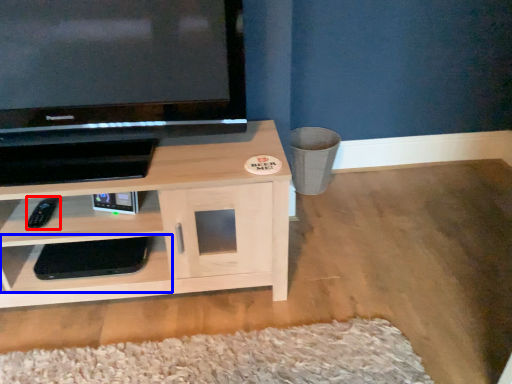
Question: Which of the following is the farthest to the observer, remote (highlighted by a red box) or shelf (highlighted by a blue box)?

Choices:
 (A) remote
 (B) shelf

Answer: (B)